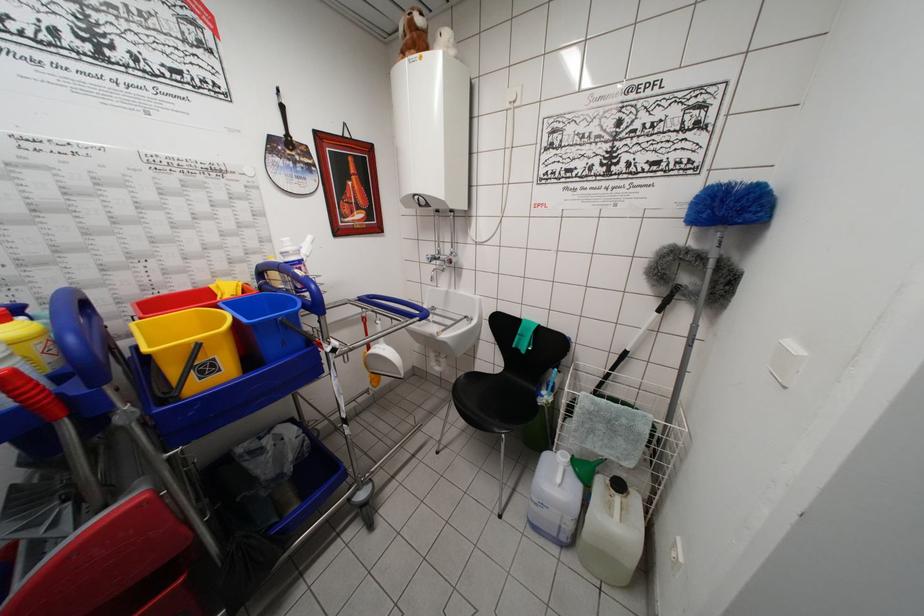
Find the location of a particular element. faucet handle is located at coordinates (441, 259).